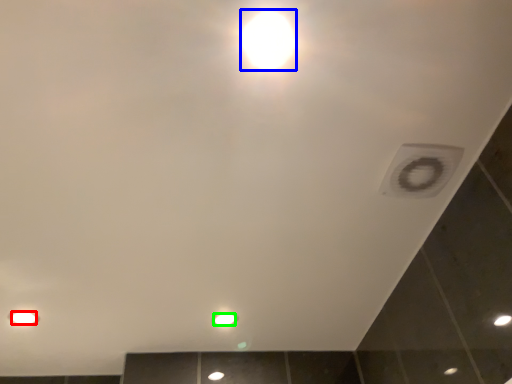
Question: Based on their relative distances, which object is farther from light bulb (highlighted by a red box)? Choose from light bulb (highlighted by a blue box) and light bulb (highlighted by a green box).

Choices:
 (A) light bulb
 (B) light bulb

Answer: (A)